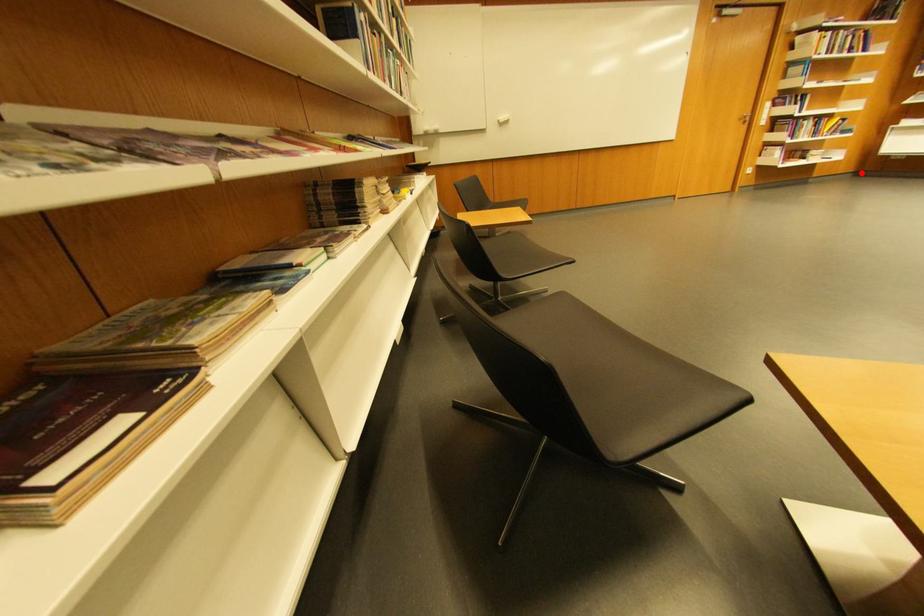
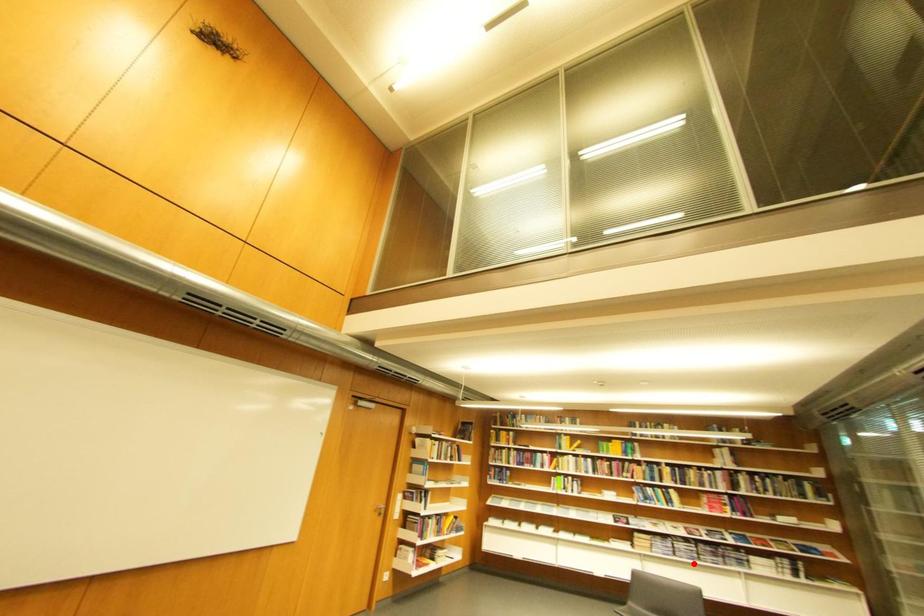
Based on the photo, I am providing you with two images of the same scene from different viewpoints. A red point is marked on the first image and another point is marked on the second image. Is the marked point in image1 the same physical position as the marked point in image2?

No